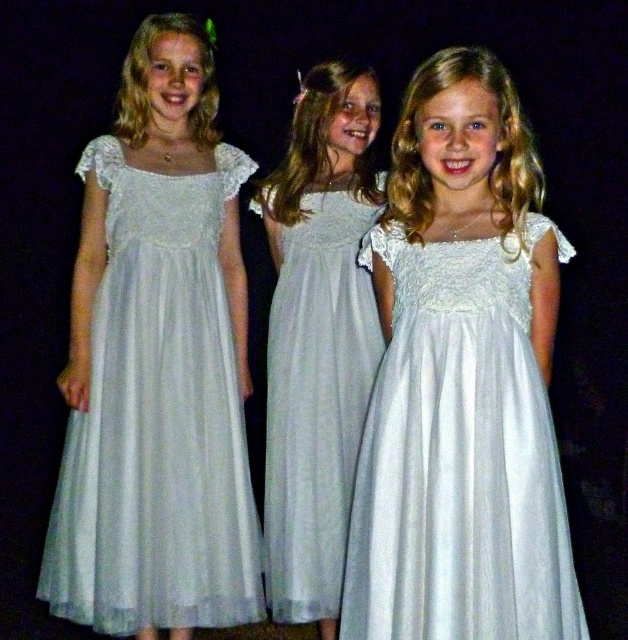
Based on the photo, in the image of the three girls standing together, which dress is positioned higher between the white sheer dress at left and the white satin dress at center?

The white sheer dress at left is positioned higher than the white satin dress at center.